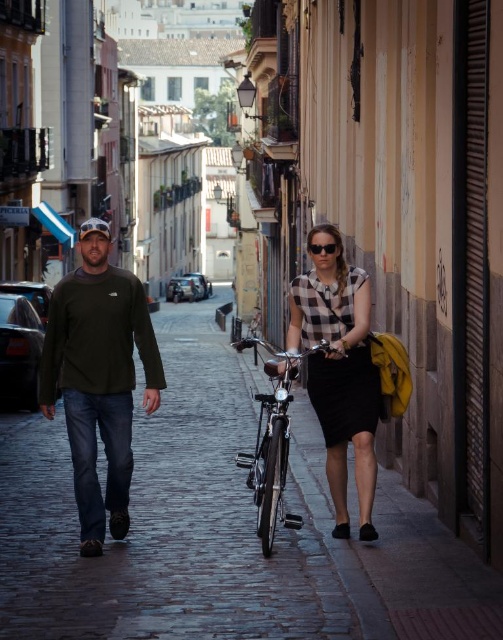
Question: Is checkered fabric shirt at center above shiny metallic bicycle at center?

Choices:
 (A) yes
 (B) no

Answer: (A)

Question: Which point is farther from the camera taking this photo?

Choices:
 (A) (292, 524)
 (B) (358, 353)
 (C) (122, 417)
 (D) (304, 275)

Answer: (D)

Question: Does checkered fabric shirt at center lie in front of black matte dress at center?

Choices:
 (A) yes
 (B) no

Answer: (A)

Question: Does black matte dress at center come behind matte black sunglasses at center?

Choices:
 (A) yes
 (B) no

Answer: (B)

Question: Which point is farther to the camera?

Choices:
 (A) (160, 317)
 (B) (325, 269)

Answer: (A)

Question: Which point is closer to the camera?

Choices:
 (A) (338, 486)
 (B) (182, 497)

Answer: (A)